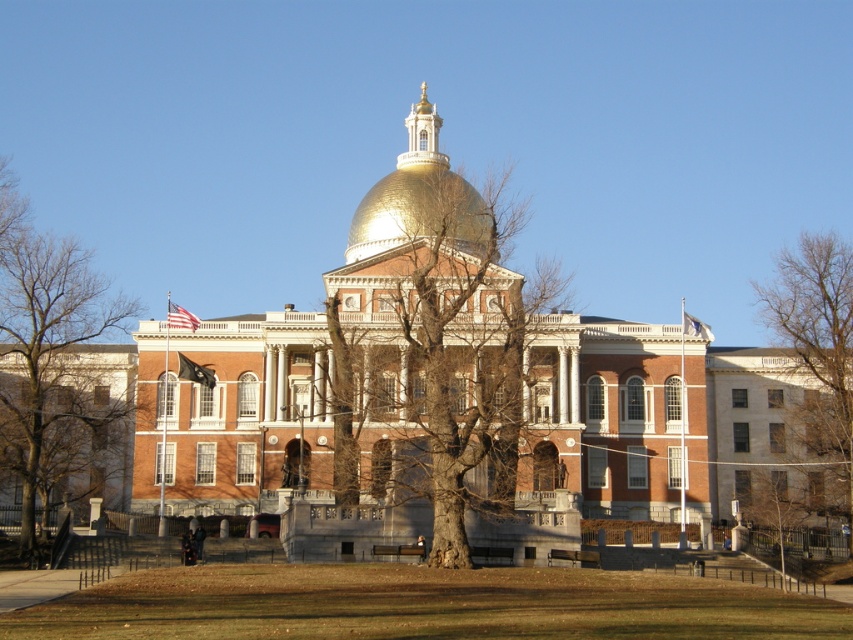
Between point (346, 273) and point (15, 266), which one is positioned behind?

Point (346, 273)

Which is in front, point (428, 371) or point (47, 410)?

Positioned in front is point (428, 371).

Where is `bare wood tree at center`? The image size is (853, 640). bare wood tree at center is located at coordinates (432, 346).

Who is more forward, (462, 429) or (828, 320)?

Positioned in front is point (462, 429).

Is bare wood tree at center shorter than bare wood tree at right?

In fact, bare wood tree at center may be taller than bare wood tree at right.

Does point (376, 372) come behind point (819, 348)?

That is False.

The height and width of the screenshot is (640, 853). I want to click on bare wood tree at center, so click(432, 346).

Is point (341, 353) positioned before point (416, 182)?

Yes, it is.

Which is behind, point (473, 346) or point (430, 198)?

Point (430, 198)

The height and width of the screenshot is (640, 853). I want to click on bare wood tree at center, so click(432, 346).

Find the location of `bare wood tree at center`. bare wood tree at center is located at coordinates (432, 346).